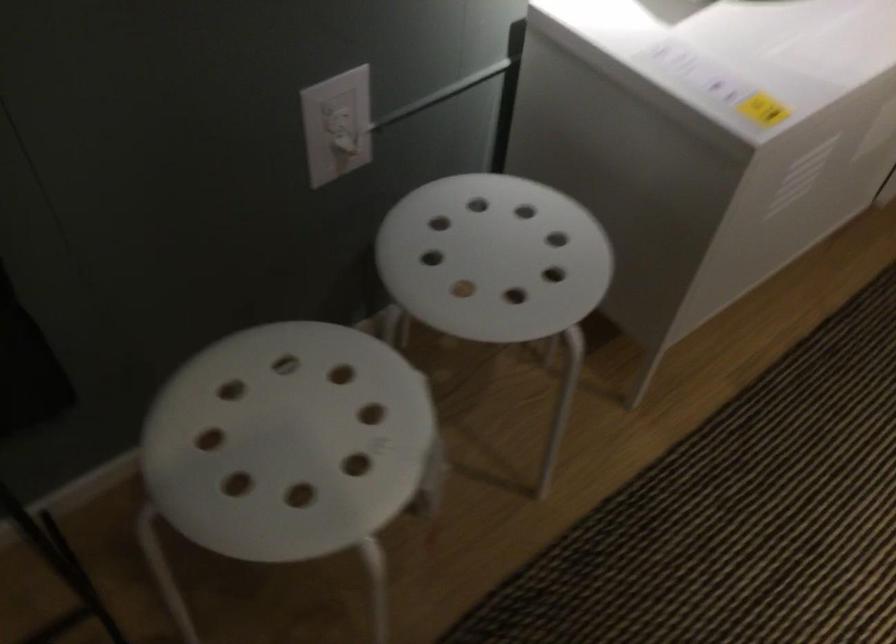
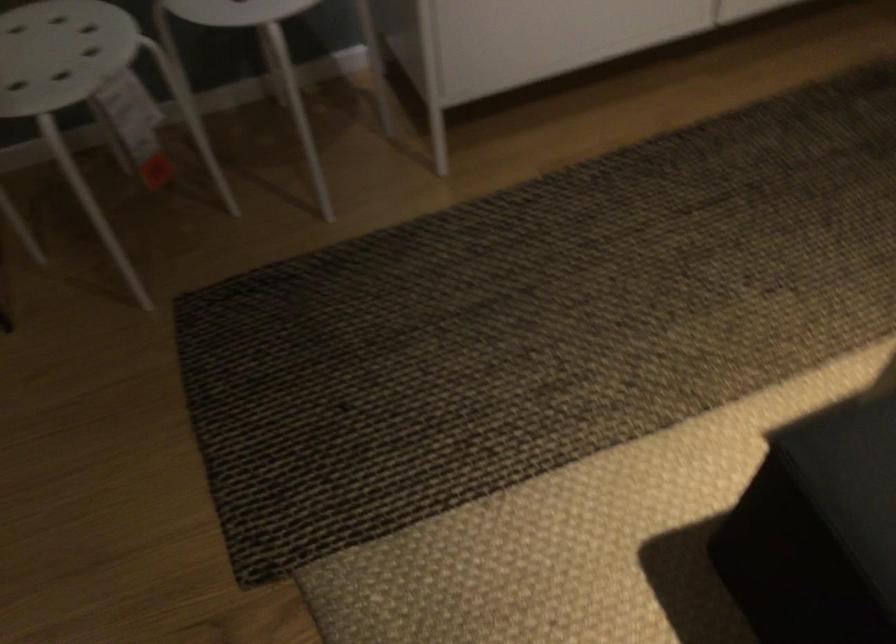
The point at (507, 307) is marked in the first image. Where is the corresponding point in the second image?

(235, 11)